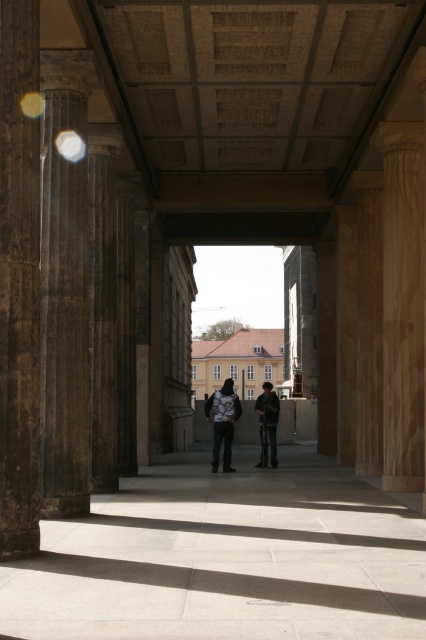
Question: Which of the following is the closest to the observer?

Choices:
 (A) dark gray jacket at center
 (B) dark gray backpack at center

Answer: (B)

Question: Does dark brown stone pillar at left have a larger size compared to dark gray jacket at center?

Choices:
 (A) no
 (B) yes

Answer: (A)

Question: Is dark brown stone pillar at left to the left of dark gray backpack at center from the viewer's perspective?

Choices:
 (A) no
 (B) yes

Answer: (B)

Question: Estimate the real-world distances between objects in this image. Which object is farther from the dark gray backpack at center?

Choices:
 (A) dark brown polished column at left
 (B) dark gray jacket at center

Answer: (A)

Question: Considering the relative positions of dark brown stone pillar at left and dark gray jacket at center in the image provided, where is dark brown stone pillar at left located with respect to dark gray jacket at center?

Choices:
 (A) right
 (B) left

Answer: (B)

Question: Considering the real-world distances, which object is closest to the dark brown polished column at left?

Choices:
 (A) dark brown stone pillar at left
 (B) dark gray backpack at center
 (C) dark gray jacket at center

Answer: (A)